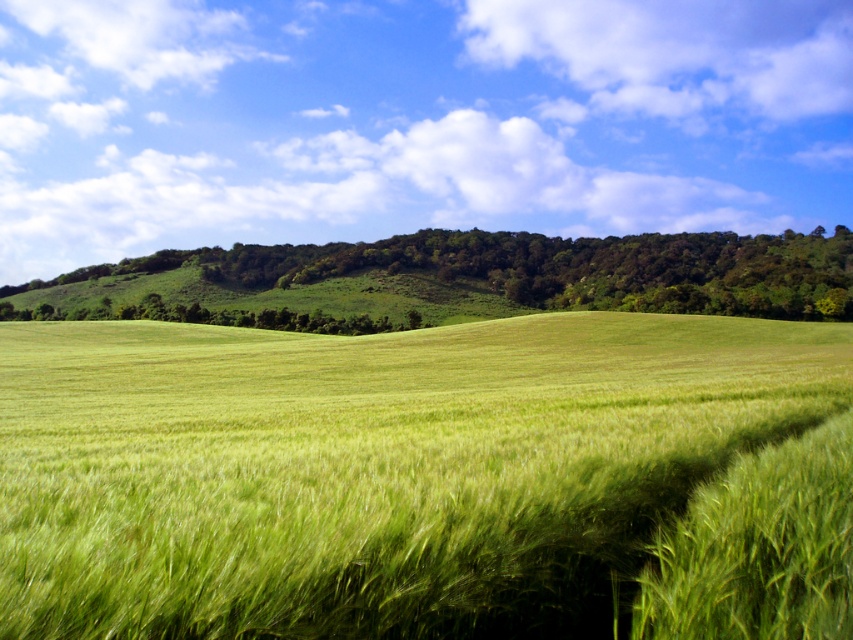
You are standing in the rural landscape and want to walk from the point at coordinates point (x=602, y=628) to the point at coordinates point (x=279, y=266). Which direction should you face to walk directly towards your destination?

Since point (x=602, y=628) is closer to the viewer than point (x=279, y=266), you should face towards the upper left direction to walk directly towards your destination.

You are a hiker planning to cross the green grassy field at center and the green grassy hillside at center. Which path would require less energy due to their thickness? Please explain your reasoning.

The green grassy field at center is thinner than the green grassy hillside at center. Since the field is thinner, it likely offers less resistance and requires less energy to traverse compared to the thicker hillside grass.

You are standing in the middle of the green grassy field at center and want to walk towards the green grassy hillside at center. In which direction should you head?

The green grassy field at center is to the left of green grassy hillside at center, so you should head to the right to reach the hillside.